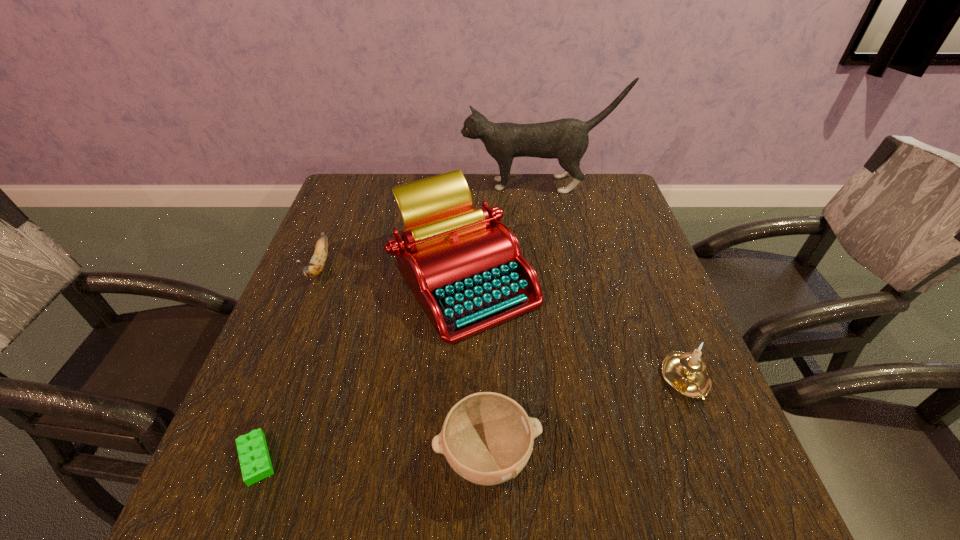
Where is `vacant area that lies between the third nearest object and the banana`? The image size is (960, 540). vacant area that lies between the third nearest object and the banana is located at coordinates (503, 323).

At what (x,y) coordinates should I click in order to perform the action: click on free space between the fifth shortest object and the shortest object. Please return your answer as a coordinate pair (x, y). Looking at the image, I should click on (361, 369).

This screenshot has width=960, height=540. I want to click on free spot between the bowl and the Lego, so click(x=372, y=457).

Find the location of a particular element. Image resolution: width=960 pixels, height=540 pixels. free space between the bowl and the second tallest object is located at coordinates pyautogui.click(x=476, y=367).

Locate an element on the screen. This screenshot has width=960, height=540. free space between the bowl and the typewriter is located at coordinates (476, 367).

What are the coordinates of `unoccupied position between the farthest object and the shortest object` in the screenshot? It's located at tap(397, 322).

This screenshot has height=540, width=960. I want to click on free point between the fourth shortest object and the farthest object, so click(x=612, y=283).

Where is `vacant area that lies between the cat and the Lego`? vacant area that lies between the cat and the Lego is located at coordinates (397, 322).

The width and height of the screenshot is (960, 540). I want to click on object that ranks as the fourth closest to the fourth farthest object, so click(253, 453).

Locate an element on the screen. The height and width of the screenshot is (540, 960). object identified as the second closest to the fourth farthest object is located at coordinates (487, 438).